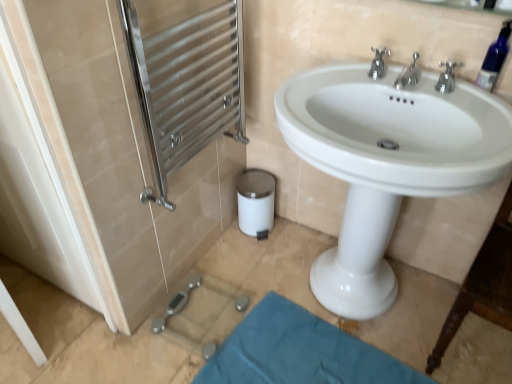
The width and height of the screenshot is (512, 384). Identify the location of vacant region to the left of silver metallic faucet at upper right, which is the third tap in left-to-right order. (401, 91).